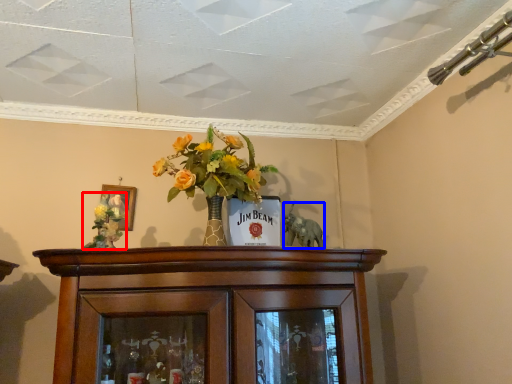
Question: Among these objects, which one is nearest to the camera, floral arrangement (highlighted by a red box) or animal (highlighted by a blue box)?

Choices:
 (A) floral arrangement
 (B) animal

Answer: (A)